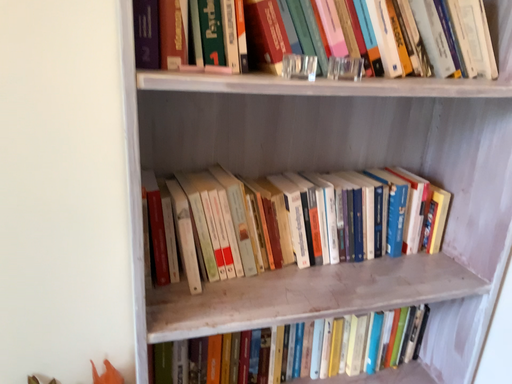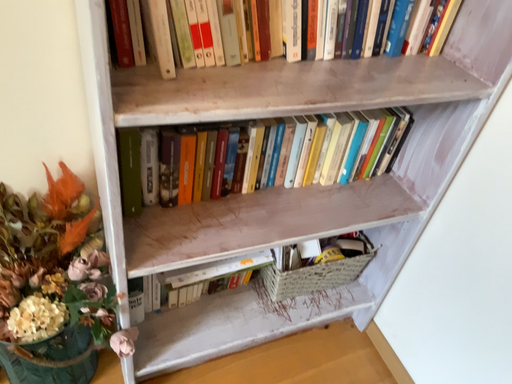
Question: Which way did the camera rotate in the video?

Choices:
 (A) rotated left
 (B) rotated right

Answer: (B)